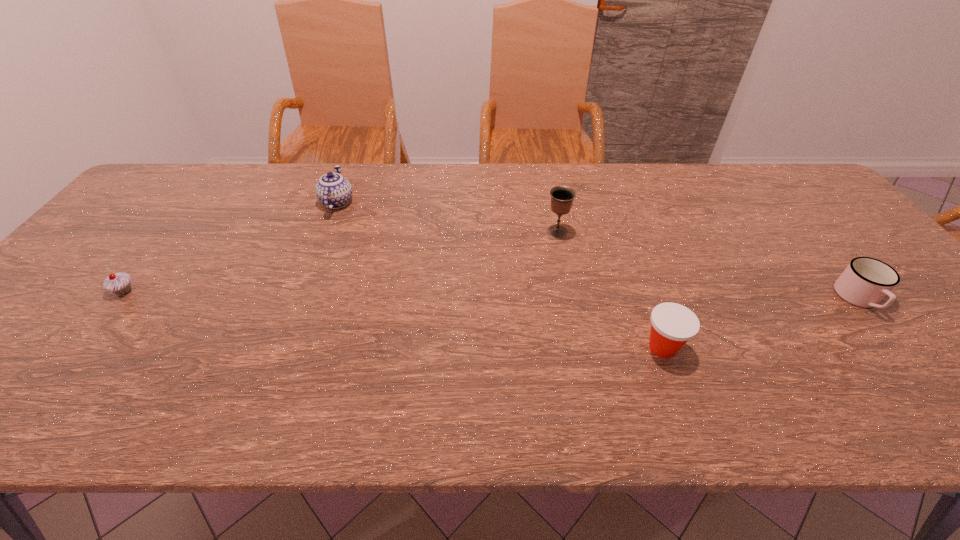
You are a GUI agent. You are given a task and a screenshot of the screen. Output one action in this format:
    pyautogui.click(x=<x>, y=<y>)
    Task: Click on the free location located 0.050m at the spout of the farthest object
    The height and width of the screenshot is (540, 960).
    Given the screenshot: What is the action you would take?
    pyautogui.click(x=347, y=178)

Where is `vacant space located at the spout of the farthest object`? Image resolution: width=960 pixels, height=540 pixels. vacant space located at the spout of the farthest object is located at coordinates (351, 165).

Locate an element on the screen. free location located on the right of the nearest object is located at coordinates (x=826, y=348).

I want to click on free space located on the back of the leftmost object, so click(142, 269).

Identify the location of blank space located 0.190m on the side of the rightmost object with the handle. (936, 393).

This screenshot has height=540, width=960. In order to click on object located at the far edge in this screenshot , I will do [x=334, y=191].

Locate an element on the screen. Image resolution: width=960 pixels, height=540 pixels. object that is at the left edge is located at coordinates (120, 283).

Find the location of a particular element. object positioned at the right edge is located at coordinates (865, 282).

In order to click on vacant point at the far edge in this screenshot , I will do [266, 185].

At what (x,y) coordinates should I click in order to perform the action: click on free space at the near edge of the desktop. Please return your answer as a coordinate pair (x, y). Looking at the image, I should click on (237, 389).